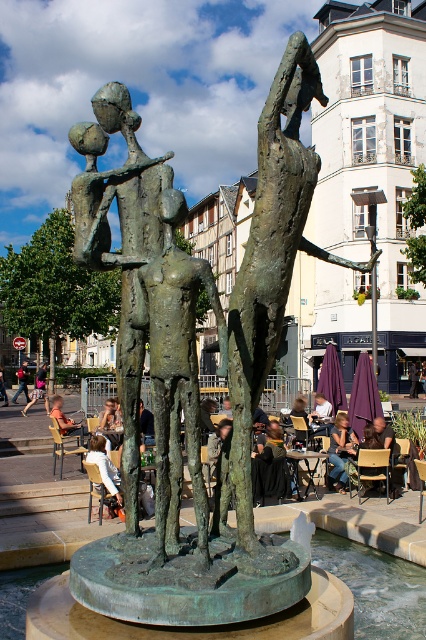
Does denim jeans at center have a lesser width compared to bronze statue at center?

Correct, denim jeans at center's width is less than bronze statue at center's.

Does point (337, 470) lie in front of point (34, 403)?

Yes, it is.

Where is `denim jeans at center`? This screenshot has height=640, width=426. denim jeans at center is located at coordinates (339, 451).

The height and width of the screenshot is (640, 426). What do you see at coordinates (66, 420) in the screenshot?
I see `light brown wooden chair at lower left` at bounding box center [66, 420].

Is point (68, 428) closer to viewer compared to point (25, 396)?

Yes.

Identify the location of light brown wooden chair at lower left. This screenshot has height=640, width=426. (66, 420).

Who is higher up, denim jeans at center or light brown wooden chair at lower left?

denim jeans at center is above.

Is point (342, 454) behind point (60, 401)?

That is False.

Between point (336, 480) and point (60, 397), which one is positioned behind?

The point (60, 397) is behind.

Locate an element on the screen. The width and height of the screenshot is (426, 640). denim jeans at center is located at coordinates (339, 451).